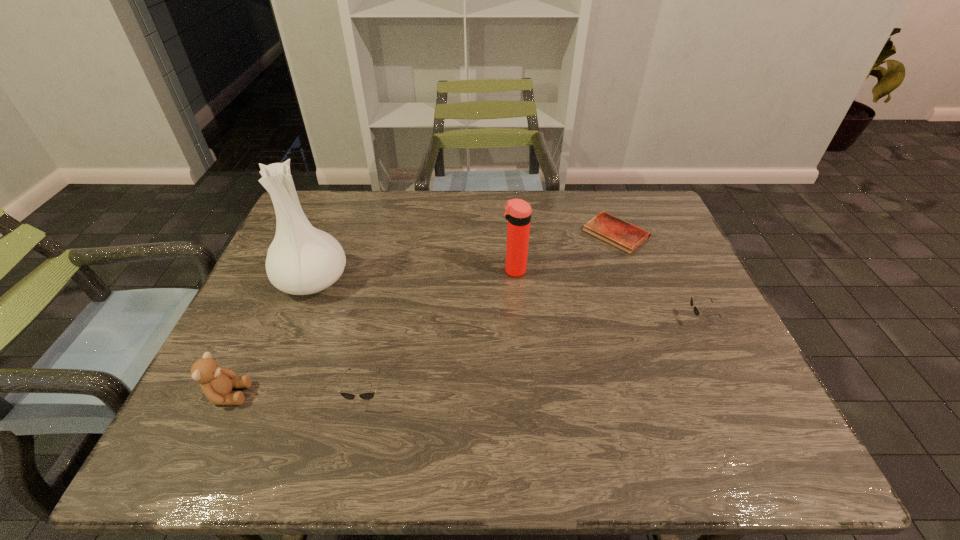
You are a GUI agent. You are given a task and a screenshot of the screen. Output one action in this format:
    pyautogui.click(x=<x>, y=<y>)
    Task: Click on the vacant space located 0.360m in front of the lenses of the farther sunglasses
    The height and width of the screenshot is (540, 960).
    Given the screenshot: What is the action you would take?
    pyautogui.click(x=540, y=320)

Where is `vacant point located 0.080m in front of the lenses of the farther sunglasses`? Image resolution: width=960 pixels, height=540 pixels. vacant point located 0.080m in front of the lenses of the farther sunglasses is located at coordinates (654, 320).

Find the location of a particular element. Image resolution: width=960 pixels, height=540 pixels. free space located 0.080m in front of the lenses of the farther sunglasses is located at coordinates (654, 320).

At what (x,y) coordinates should I click in order to perform the action: click on vacant point located on the left of the shortest object. Please return your answer as a coordinate pair (x, y). This screenshot has height=540, width=960. Looking at the image, I should click on (477, 233).

You are a GUI agent. You are given a task and a screenshot of the screen. Output one action in this format:
    pyautogui.click(x=<x>, y=<y>)
    Task: Click on the free space located on the front of the vase
    
    Given the screenshot: What is the action you would take?
    pyautogui.click(x=269, y=389)

Find the location of `vacant space located on the front-facing side of the teddy bear`. vacant space located on the front-facing side of the teddy bear is located at coordinates (315, 395).

Where is `vacant space located on the back of the second tallest object`? The image size is (960, 540). vacant space located on the back of the second tallest object is located at coordinates (508, 202).

I want to click on object located at the far edge, so click(x=619, y=233).

Image resolution: width=960 pixels, height=540 pixels. What are the coordinates of `sunglasses situated at the near edge` in the screenshot? It's located at (365, 395).

The height and width of the screenshot is (540, 960). Find the location of `teddy bear present at the near edge`. teddy bear present at the near edge is located at coordinates (217, 383).